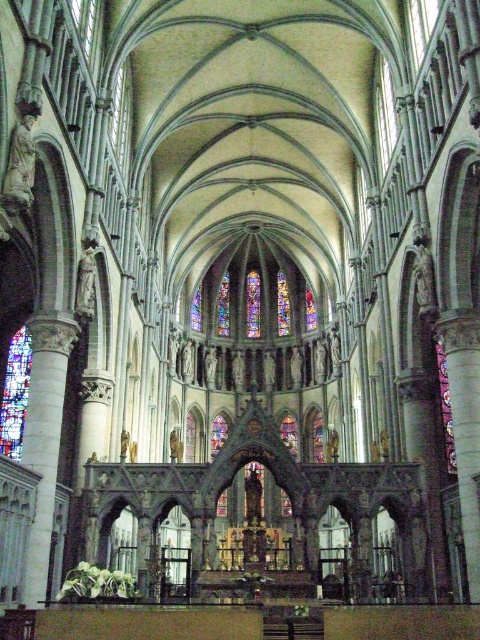
Question: Can you confirm if stained glass window at left is positioned below transparent stained glass at center?

Choices:
 (A) no
 (B) yes

Answer: (A)

Question: Does stained glass window at left appear on the right side of stained glass at center?

Choices:
 (A) no
 (B) yes

Answer: (A)

Question: Which point appears closest to the camera in this image?

Choices:
 (A) (20, 442)
 (B) (172, 579)

Answer: (A)

Question: Which object appears farthest from the camera in this image?

Choices:
 (A) stained glass at center
 (B) stained glass window at center
 (C) transparent stained glass at center

Answer: (A)

Question: Considering the real-world distances, which object is farthest from the transparent stained glass at upper center?

Choices:
 (A) stained glass window at center
 (B) stained glass at center
 (C) stained glass window at left

Answer: (B)

Question: Can you confirm if transparent stained glass at center is positioned to the left of transparent stained glass at upper center?

Choices:
 (A) yes
 (B) no

Answer: (A)